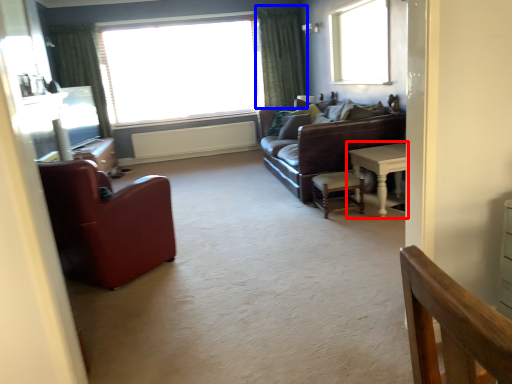
Question: Which object appears farthest to the camera in this image, table (highlighted by a red box) or curtain (highlighted by a blue box)?

Choices:
 (A) table
 (B) curtain

Answer: (B)